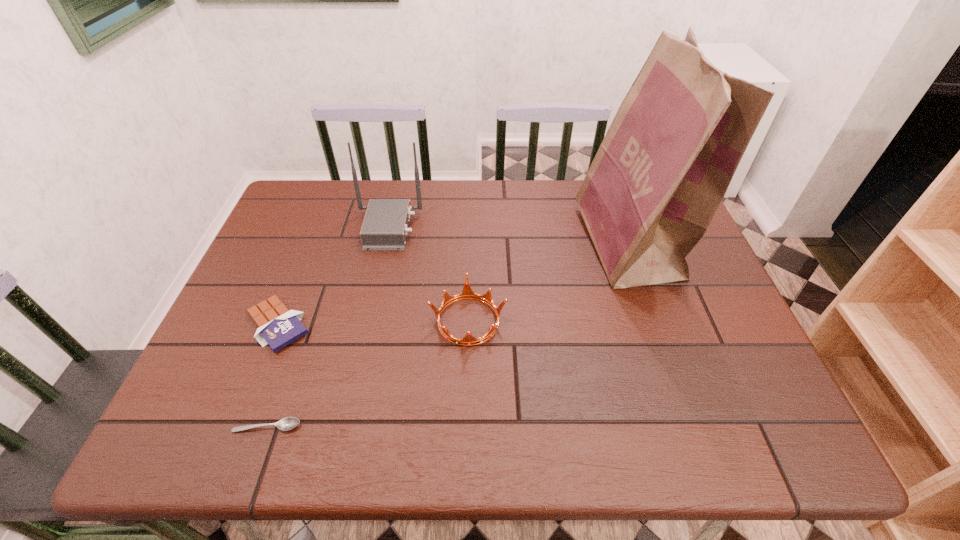
What are the coordinates of `vacant region that satisfies the following two spatial constraints: 1. on the front-facing side of the grocery bag; 2. on the front side of the chocolate bar` in the screenshot? It's located at (656, 325).

I want to click on free space that satisfies the following two spatial constraints: 1. on the back side of the third tallest object; 2. on the back of the router to connect cables, so click(470, 228).

What are the coordinates of `free space that satisfies the following two spatial constraints: 1. on the front-facing side of the tallest object; 2. on the front side of the third tallest object` in the screenshot? It's located at (655, 321).